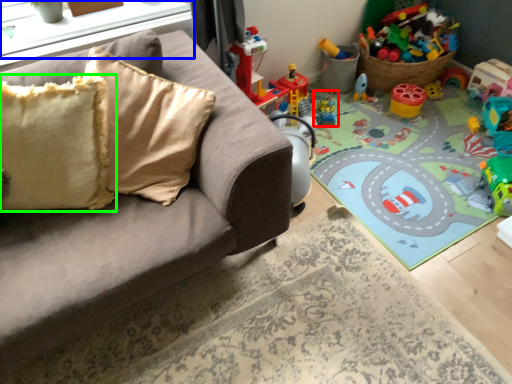
Question: Considering the real-world distances, which object is farthest from toy (highlighted by a red box)? window sill (highlighted by a blue box) or pillow (highlighted by a green box)?

Choices:
 (A) window sill
 (B) pillow

Answer: (B)